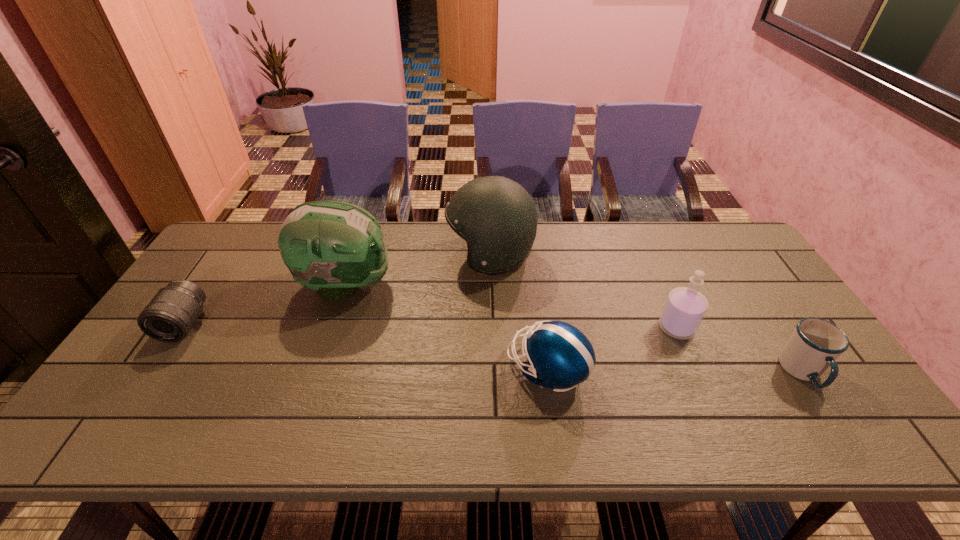
Identify the location of vacant space at the far right corner of the desktop. (733, 249).

The height and width of the screenshot is (540, 960). I want to click on vacant space in between the telephoto lens and the rightmost object, so click(x=493, y=348).

In order to click on blank region between the second object from right to left and the mug in this screenshot , I will do `click(739, 350)`.

You are a GUI agent. You are given a task and a screenshot of the screen. Output one action in this format:
    pyautogui.click(x=<x>, y=<y>)
    Task: Click on the vacant space that's between the nearest football helmet and the fifth object from right to left
    The width and height of the screenshot is (960, 540).
    Given the screenshot: What is the action you would take?
    pyautogui.click(x=446, y=327)

Locate an element on the screen. empty space that is in between the nearest football helmet and the leftmost object is located at coordinates (366, 347).

Locate an element on the screen. free area in between the shortest football helmet and the rightmost object is located at coordinates (675, 370).

Point out which object is positioned as the fourth nearest to the leftmost object. Please provide its 2D coordinates. Your answer should be formatted as a tuple, i.e. [(x, y)], where the tuple contains the x and y coordinates of a point satisfying the conditions above.

[(685, 307)]

At what (x,y) coordinates should I click in order to perform the action: click on object that is the fifth closest to the perfume. Please return your answer as a coordinate pair (x, y). The width and height of the screenshot is (960, 540). Looking at the image, I should click on (170, 315).

I want to click on football helmet that can be found as the second closest to the second object from left to right, so click(560, 356).

Locate an element on the screen. This screenshot has width=960, height=540. the closest football helmet to the second object from left to right is located at coordinates (496, 216).